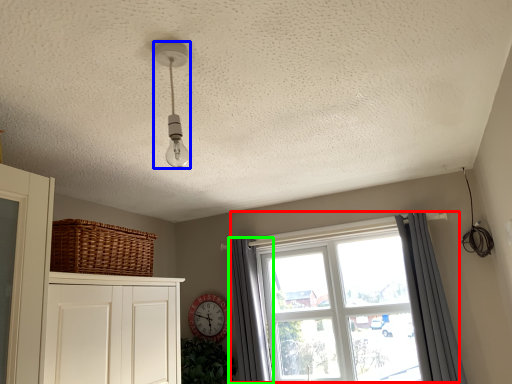
Question: Estimate the real-world distances between objects in this image. Which object is farther from window (highlighted by a red box), light fixture (highlighted by a blue box) or curtain (highlighted by a green box)?

Choices:
 (A) light fixture
 (B) curtain

Answer: (A)